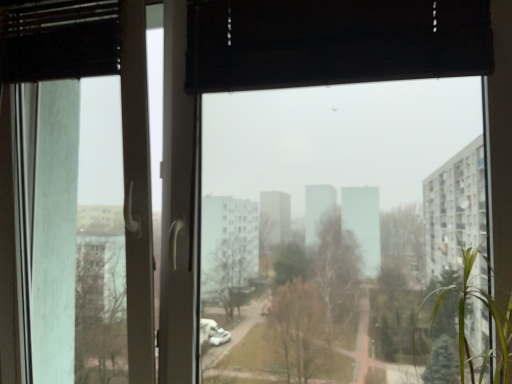
Question: From the image's perspective, is transparent glass screen door at left on green leafy plant at right?

Choices:
 (A) no
 (B) yes

Answer: (B)

Question: Is transparent glass screen door at left to the left of green leafy plant at right from the viewer's perspective?

Choices:
 (A) yes
 (B) no

Answer: (A)

Question: Does transparent glass screen door at left have a lesser width compared to green leafy plant at right?

Choices:
 (A) no
 (B) yes

Answer: (B)

Question: Does transparent glass screen door at left come behind green leafy plant at right?

Choices:
 (A) yes
 (B) no

Answer: (A)

Question: Can green leafy plant at right be found inside transparent glass screen door at left?

Choices:
 (A) no
 (B) yes

Answer: (A)

Question: Can you confirm if transparent glass screen door at left is smaller than green leafy plant at right?

Choices:
 (A) no
 (B) yes

Answer: (A)

Question: Is transparent glass screen door at left further to the viewer compared to transparent glass window at center?

Choices:
 (A) no
 (B) yes

Answer: (B)

Question: Are transparent glass screen door at left and transparent glass window at center making contact?

Choices:
 (A) yes
 (B) no

Answer: (B)

Question: Is transparent glass screen door at left closer to camera compared to transparent glass window at center?

Choices:
 (A) no
 (B) yes

Answer: (A)

Question: Does transparent glass screen door at left turn towards transparent glass window at center?

Choices:
 (A) yes
 (B) no

Answer: (B)

Question: From the image's perspective, is transparent glass screen door at left below transparent glass window at center?

Choices:
 (A) no
 (B) yes

Answer: (B)

Question: Is transparent glass window at center a part of transparent glass screen door at left?

Choices:
 (A) no
 (B) yes

Answer: (A)

Question: Does transparent glass window at center have a larger size compared to transparent glass screen door at left?

Choices:
 (A) no
 (B) yes

Answer: (A)